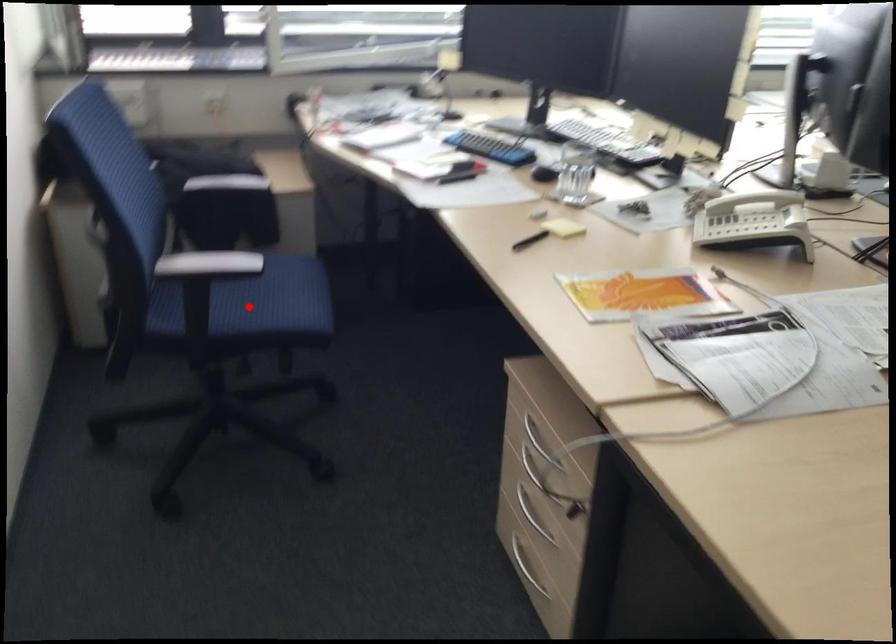
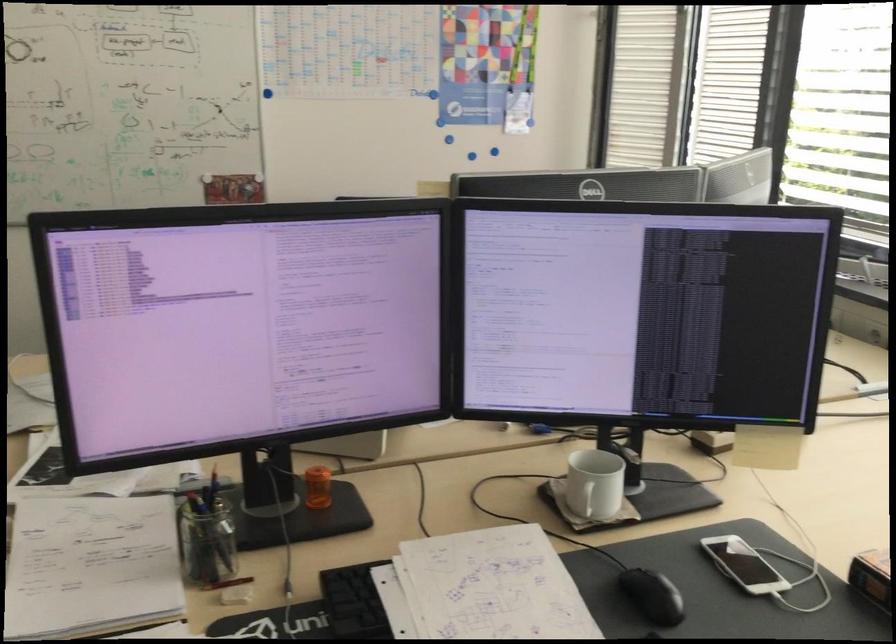
Question: I am providing you with two images of the same scene from different viewpoints. A red point is marked on the first image. Can you still see the location of the red point in image 2?

Choices:
 (A) Yes
 (B) No

Answer: (B)